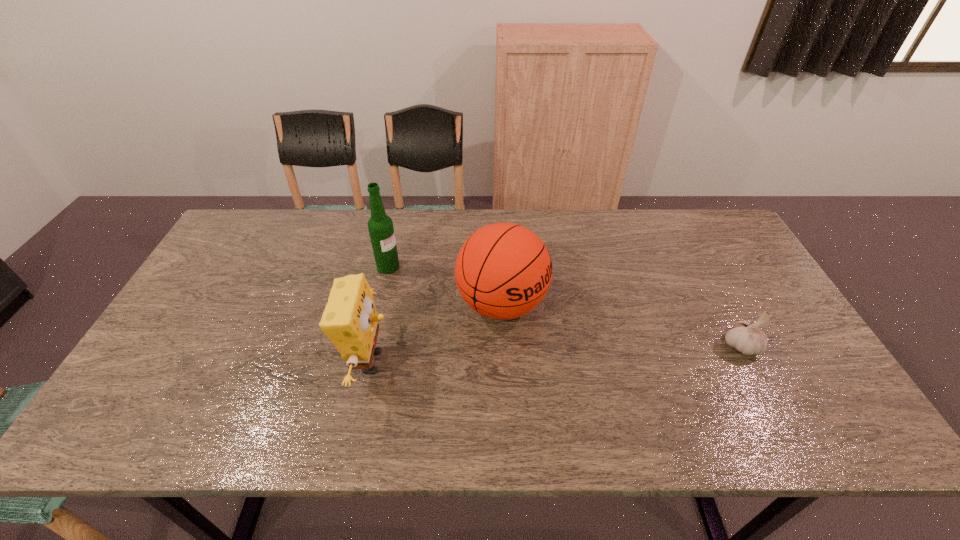
The height and width of the screenshot is (540, 960). Identify the location of vacant space at the near right corner. (795, 385).

Locate an element on the screen. Image resolution: width=960 pixels, height=540 pixels. unoccupied area between the shortest object and the beer bottle is located at coordinates (564, 306).

Find the location of a particular element. free space that is in between the beer bottle and the basketball is located at coordinates (445, 285).

Where is `free space between the sponge and the shortest object`? This screenshot has height=540, width=960. free space between the sponge and the shortest object is located at coordinates pos(556,354).

Find the location of a particular element. The height and width of the screenshot is (540, 960). empty space that is in between the second object from right to left and the beer bottle is located at coordinates [445, 285].

Where is `free space that is in between the basketball and the garlic`? The image size is (960, 540). free space that is in between the basketball and the garlic is located at coordinates (621, 325).

The width and height of the screenshot is (960, 540). In order to click on free spot between the beer bottle and the second object from right to left in this screenshot , I will do `click(445, 285)`.

Find the location of a particular element. This screenshot has width=960, height=540. vacant region between the basketball and the shortest object is located at coordinates (621, 325).

Locate an element on the screen. Image resolution: width=960 pixels, height=540 pixels. object that is the third closest to the garlic is located at coordinates (380, 226).

Select which object appears as the third closest to the beer bottle. Please provide its 2D coordinates. Your answer should be formatted as a tuple, i.e. [(x, y)], where the tuple contains the x and y coordinates of a point satisfying the conditions above.

[(747, 338)]